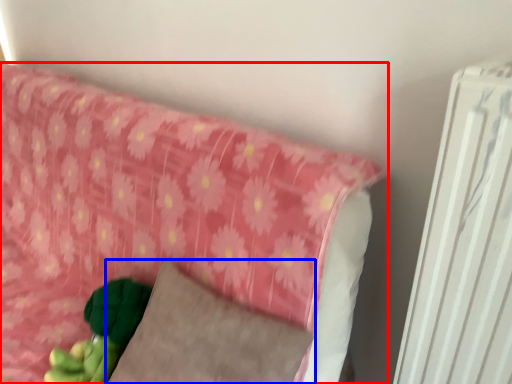
Question: Which object is closer to the camera taking this photo, furniture (highlighted by a red box) or pillow (highlighted by a blue box)?

Choices:
 (A) furniture
 (B) pillow

Answer: (A)